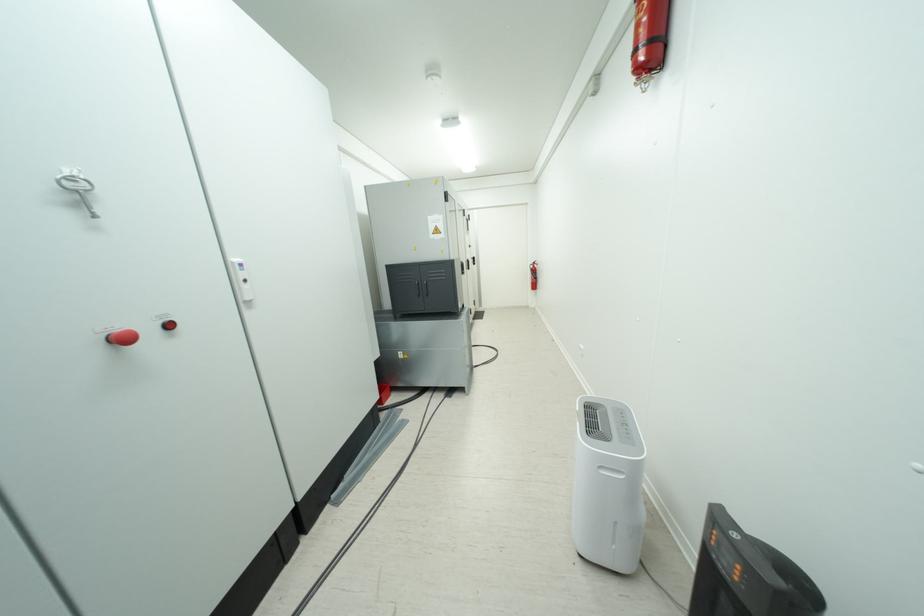
Describe the element at coordinates (122, 338) in the screenshot. I see `the red emergency button` at that location.